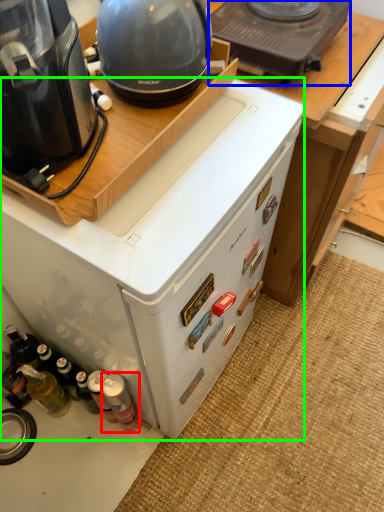
Question: Considering the real-world distances, which object is farthest from bottle (highlighted by a red box)? kitchen appliance (highlighted by a blue box) or home appliance (highlighted by a green box)?

Choices:
 (A) kitchen appliance
 (B) home appliance

Answer: (A)